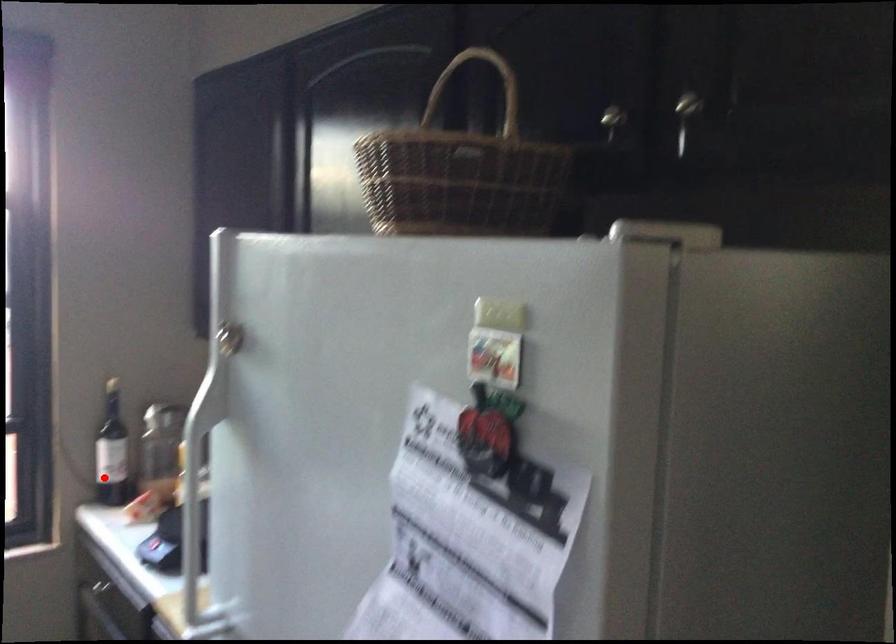
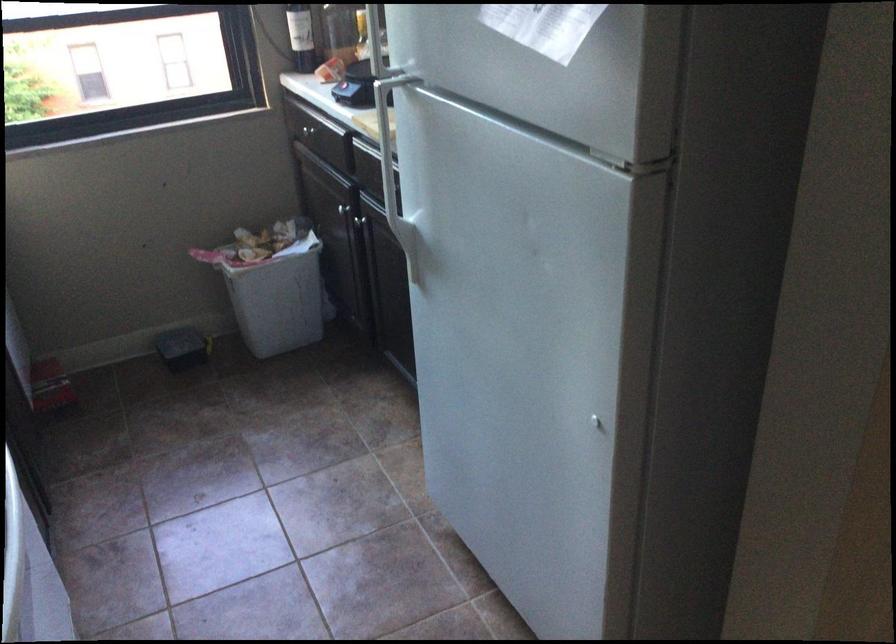
Where in the second image is the point corresponding to the highlighted location from the first image?

(300, 37)